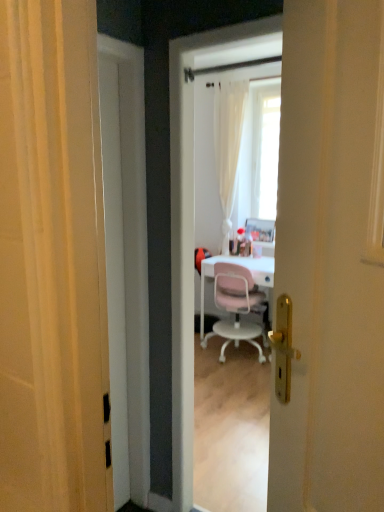
Question: Does white glossy door at center appear on the right side of white glossy screen door at center?

Choices:
 (A) no
 (B) yes

Answer: (A)

Question: Is white glossy screen door at center a part of white glossy door at center?

Choices:
 (A) yes
 (B) no

Answer: (B)

Question: Is white glossy door at center bigger than white glossy screen door at center?

Choices:
 (A) yes
 (B) no

Answer: (B)

Question: Can you confirm if white glossy door at center is shorter than white glossy screen door at center?

Choices:
 (A) no
 (B) yes

Answer: (B)

Question: Would you say white glossy door at center is a long distance from white glossy screen door at center?

Choices:
 (A) no
 (B) yes

Answer: (B)

Question: From a real-world perspective, is white glossy door at center positioned above or below pink plastic chair at center?

Choices:
 (A) above
 (B) below

Answer: (A)

Question: Is white glossy door at center in front of or behind pink plastic chair at center in the image?

Choices:
 (A) behind
 (B) front

Answer: (B)

Question: Is white glossy door at center spatially inside pink plastic chair at center, or outside of it?

Choices:
 (A) outside
 (B) inside

Answer: (A)

Question: In terms of size, does white glossy door at center appear bigger or smaller than pink plastic chair at center?

Choices:
 (A) small
 (B) big

Answer: (A)

Question: Considering the positions of pink plastic chair at center and white glossy screen door at center in the image, is pink plastic chair at center wider or thinner than white glossy screen door at center?

Choices:
 (A) thin
 (B) wide

Answer: (B)

Question: From their relative heights in the image, would you say pink plastic chair at center is taller or shorter than white glossy screen door at center?

Choices:
 (A) short
 (B) tall

Answer: (A)

Question: Looking at the image, does pink plastic chair at center seem bigger or smaller compared to white glossy screen door at center?

Choices:
 (A) big
 (B) small

Answer: (A)

Question: From a real-world perspective, relative to white glossy screen door at center, is pink plastic chair at center vertically above or below?

Choices:
 (A) above
 (B) below

Answer: (B)

Question: From a real-world perspective, is white glossy door at center above or below white glossy screen door at center?

Choices:
 (A) below
 (B) above

Answer: (A)

Question: In the image, is white glossy door at center positioned in front of or behind white glossy screen door at center?

Choices:
 (A) behind
 (B) front

Answer: (A)